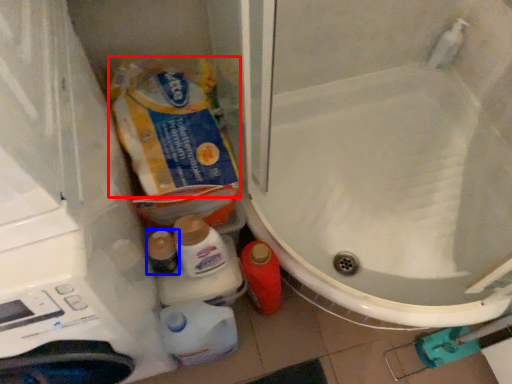
Question: Which object is further to the camera taking this photo, product (highlighted by a red box) or toiletry (highlighted by a blue box)?

Choices:
 (A) product
 (B) toiletry

Answer: (B)